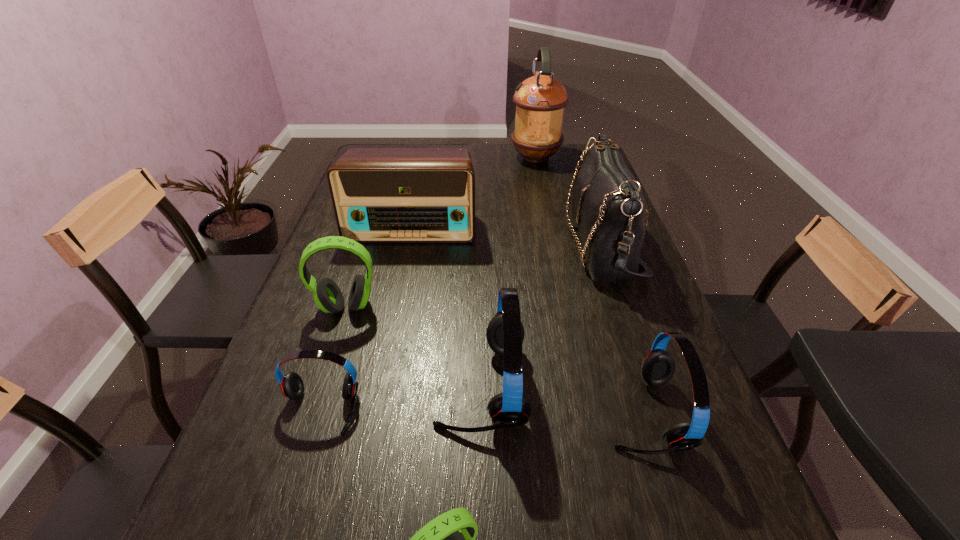
The height and width of the screenshot is (540, 960). I want to click on the farthest object, so click(540, 100).

Locate an element on the screen. the tallest object is located at coordinates (540, 100).

In order to click on handbag in this screenshot , I will do `click(608, 207)`.

Where is `radio receiver`? The width and height of the screenshot is (960, 540). radio receiver is located at coordinates (380, 195).

Identify the location of the second red headset from left to right. (505, 333).

In order to click on the left green headset in this screenshot , I will do `click(327, 295)`.

In order to click on the bigger green headset in this screenshot , I will do `click(327, 295)`.

You are a GUI agent. You are given a task and a screenshot of the screen. Output one action in this format:
    pyautogui.click(x=<x>, y=<y>)
    Task: Click on the rightmost headset
    The width and height of the screenshot is (960, 540).
    Given the screenshot: What is the action you would take?
    pyautogui.click(x=658, y=367)

Find the location of a particular element. the rightmost red headset is located at coordinates (658, 367).

The height and width of the screenshot is (540, 960). What are the coordinates of `the smallest red headset` in the screenshot? It's located at click(292, 386).